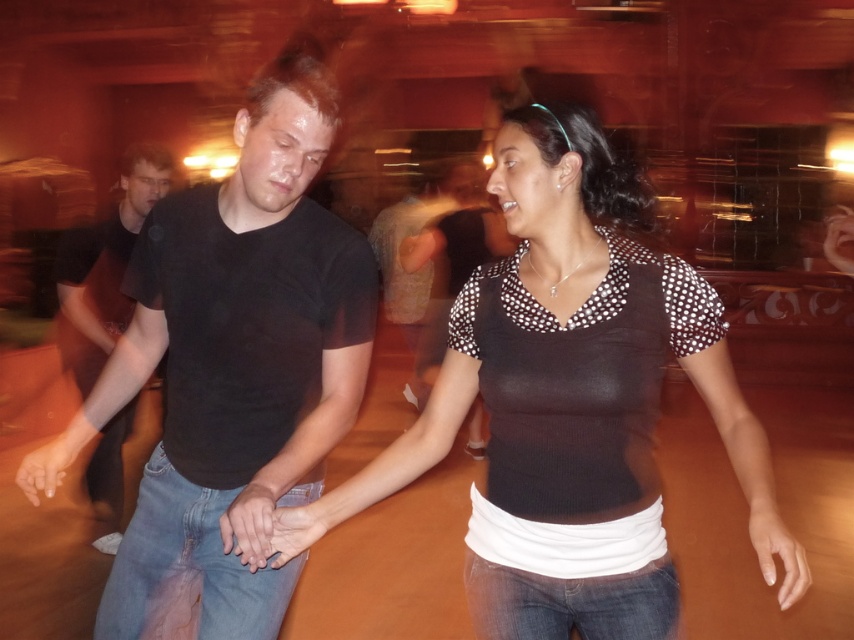
You are a photographer at the dance hall. You need to capture a photo where the black knitted top at center and the black cotton shirt at left are both visible. Which one will appear higher in the photo?

The black knitted top at center will appear higher in the photo because it is located above the black cotton shirt at left.

You are standing in the dance hall and see two points in the image. The first point is at coordinates point (757, 422) and the second is at point (120, 454). Which point is closer to you?

Point (757, 422) is closer to the viewer than point (120, 454).